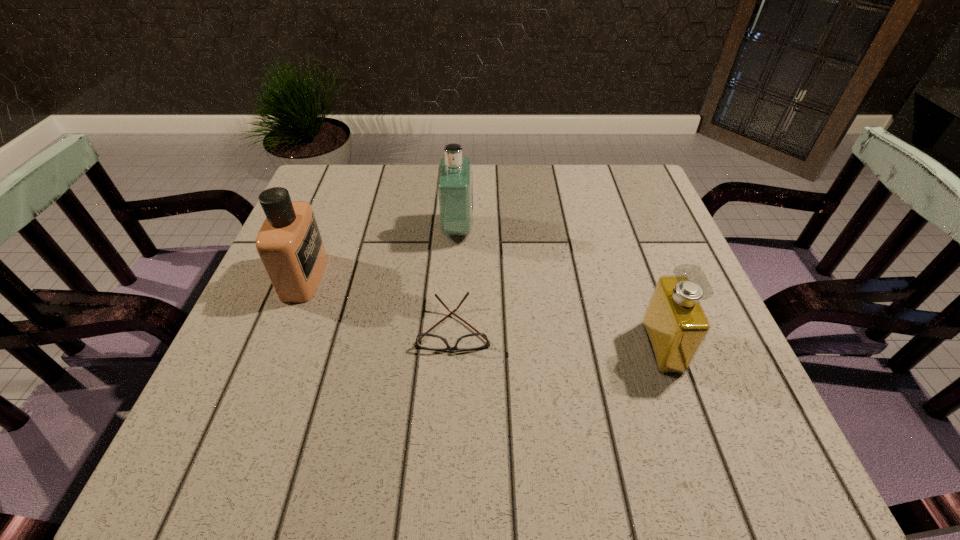
Where is `free region at the near left corner of the desktop`? free region at the near left corner of the desktop is located at coordinates (196, 433).

The width and height of the screenshot is (960, 540). I want to click on free region at the far right corner of the desktop, so click(616, 175).

Locate an element on the screen. The image size is (960, 540). free space between the farthest perfume and the shortest object is located at coordinates (455, 278).

Image resolution: width=960 pixels, height=540 pixels. In order to click on free space that is in between the leftmost object and the spectacles in this screenshot , I will do `click(379, 302)`.

The image size is (960, 540). I want to click on free space between the second nearest perfume and the nearest perfume, so click(484, 312).

You are a GUI agent. You are given a task and a screenshot of the screen. Output one action in this format:
    pyautogui.click(x=<x>, y=<y>)
    Task: Click on the vacant point located between the shortest object and the rightmost object
    This screenshot has height=540, width=960.
    Given the screenshot: What is the action you would take?
    pyautogui.click(x=558, y=337)

You are a GUI agent. You are given a task and a screenshot of the screen. Output one action in this format:
    pyautogui.click(x=<x>, y=<y>)
    Task: Click on the free space that is in between the rightmost object and the second farthest object
    This screenshot has width=960, height=540.
    Given the screenshot: What is the action you would take?
    pyautogui.click(x=484, y=312)

You are a GUI agent. You are given a task and a screenshot of the screen. Output one action in this format:
    pyautogui.click(x=<x>, y=<y>)
    Task: Click on the free space between the second perfume from left to right and the spectacles
    
    Given the screenshot: What is the action you would take?
    pyautogui.click(x=455, y=278)

The width and height of the screenshot is (960, 540). Identify the location of vacant space that is in between the spectacles and the farthest perfume. (455, 278).

Where is `empty location between the nearest perfume and the second perfume from right to left`? empty location between the nearest perfume and the second perfume from right to left is located at coordinates (560, 288).